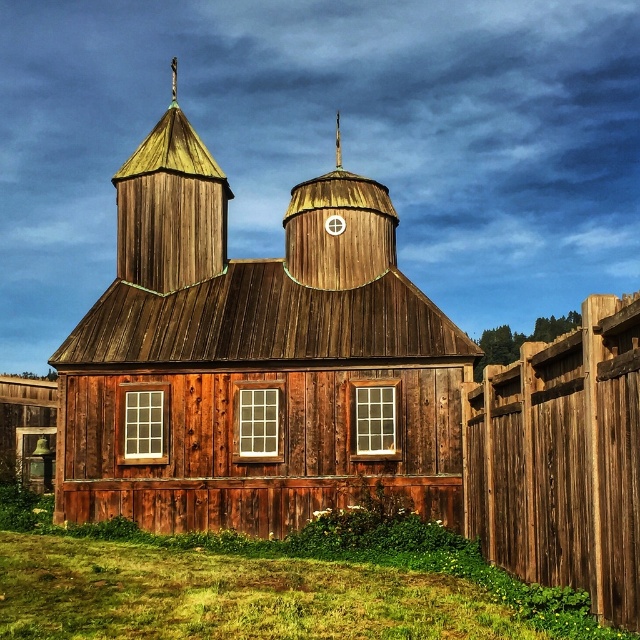
You are standing in front of the church and want to take a photo of the gold textured spire at upper center without including the brown wooden fence at right in the frame. Which direction should you move to achieve this?

Move to the right side of the gold textured spire at upper center to avoid the brown wooden fence at right, as the fence is located to the right of the spire.

You are standing in front of the wooden chapel at center and want to see the wooden spire at center. Which direction should you look relative to your current position?

The wooden chapel at center is above the wooden spire at center, so you should look downward to see the wooden spire at center.

You are standing at the camera position and want to take a photo of the wooden shingles spire at upper left. If your camera has a maximum zoom range of 25 meters, will you be able to capture the spire clearly?

The wooden shingles spire at upper left and camera are 26.33 meters apart from each other. Since the maximum zoom range is 25 meters, the camera cannot capture the spire clearly at this distance.